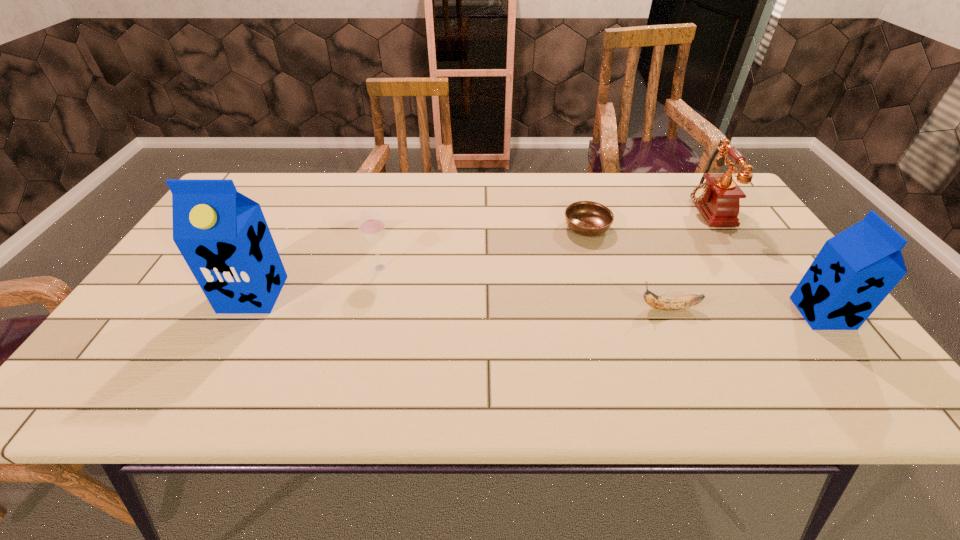
Where is `vacant space located 0.120m with the cap open on the taller carton`? Image resolution: width=960 pixels, height=540 pixels. vacant space located 0.120m with the cap open on the taller carton is located at coordinates (221, 356).

Identify the location of free spot located 0.250m on the left of the soup bowl. The width and height of the screenshot is (960, 540). (475, 227).

Image resolution: width=960 pixels, height=540 pixels. What are the coordinates of `vacant space located 0.180m on the dial of the telephone` in the screenshot? It's located at (625, 208).

Locate an element on the screen. This screenshot has width=960, height=540. vacant space located on the dial of the telephone is located at coordinates [612, 208].

At what (x,y) coordinates should I click in order to perform the action: click on vacant space located on the dial of the telephone. Please return your answer as a coordinate pair (x, y). Looking at the image, I should click on (659, 208).

Where is `vacant space located on the peel of the banana`? Image resolution: width=960 pixels, height=540 pixels. vacant space located on the peel of the banana is located at coordinates (474, 308).

Locate an element on the screen. The height and width of the screenshot is (540, 960). vacant space located on the peel of the banana is located at coordinates (616, 308).

Where is `free location located on the peel of the banana`? The width and height of the screenshot is (960, 540). free location located on the peel of the banana is located at coordinates (608, 308).

Find the location of a particular element. This screenshot has width=960, height=540. vacant space located on the back of the wineglass is located at coordinates (391, 225).

Where is `soup bowl at the far edge`? This screenshot has height=540, width=960. soup bowl at the far edge is located at coordinates (587, 218).